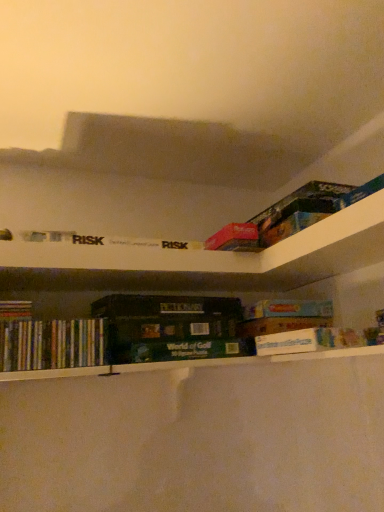
Question: From a real-world perspective, is multicolored paperbacks at lower left, the second book when ordered from right to left, on hardcover dictionary at center?

Choices:
 (A) yes
 (B) no

Answer: (B)

Question: Is multicolored paperbacks at lower left, the second book when ordered from right to left, outside of hardcover dictionary at center?

Choices:
 (A) yes
 (B) no

Answer: (A)

Question: From a real-world perspective, is multicolored paperbacks at lower left, the second book when ordered from right to left, physically below hardcover dictionary at center?

Choices:
 (A) no
 (B) yes

Answer: (B)

Question: Does multicolored paperbacks at lower left, the second book when ordered from right to left, lie behind hardcover dictionary at center?

Choices:
 (A) no
 (B) yes

Answer: (A)

Question: Would you say multicolored paperbacks at lower left, the second book when ordered from right to left, contains hardcover dictionary at center?

Choices:
 (A) no
 (B) yes

Answer: (A)

Question: From the image's perspective, relative to white cardboard box at center, which appears as the first book when viewed from the right, is multicolored paperbacks at lower left, which is counted as the first book, starting from the left, above or below?

Choices:
 (A) below
 (B) above

Answer: (A)

Question: Which is correct: multicolored paperbacks at lower left, which is counted as the first book, starting from the left, is inside white cardboard box at center, which appears as the first book when viewed from the right, or outside of it?

Choices:
 (A) inside
 (B) outside

Answer: (B)

Question: In terms of height, does multicolored paperbacks at lower left, the second book when ordered from right to left, look taller or shorter compared to white cardboard box at center, the second book when ordered from left to right?

Choices:
 (A) tall
 (B) short

Answer: (A)

Question: Considering the positions of multicolored paperbacks at lower left, which is counted as the first book, starting from the left, and white cardboard box at center, the second book when ordered from left to right, in the image, is multicolored paperbacks at lower left, which is counted as the first book, starting from the left, bigger or smaller than white cardboard box at center, the second book when ordered from left to right,?

Choices:
 (A) small
 (B) big

Answer: (A)

Question: Does point (347, 346) appear closer or farther from the camera than point (187, 304)?

Choices:
 (A) closer
 (B) farther

Answer: (A)

Question: Considering their positions, is white cardboard box at center, the second book when ordered from left to right, located in front of or behind hardcover dictionary at center?

Choices:
 (A) front
 (B) behind

Answer: (A)

Question: From the image's perspective, is white cardboard box at center, the second book when ordered from left to right, above or below hardcover dictionary at center?

Choices:
 (A) above
 (B) below

Answer: (B)

Question: Is white cardboard box at center, the second book when ordered from left to right, taller or shorter than hardcover dictionary at center?

Choices:
 (A) short
 (B) tall

Answer: (B)

Question: In the image, is multicolored paperbacks at lower left, which is counted as the first book, starting from the left, positioned in front of or behind hardcover dictionary at center?

Choices:
 (A) behind
 (B) front

Answer: (B)

Question: In terms of height, does multicolored paperbacks at lower left, which is counted as the first book, starting from the left, look taller or shorter compared to hardcover dictionary at center?

Choices:
 (A) tall
 (B) short

Answer: (A)